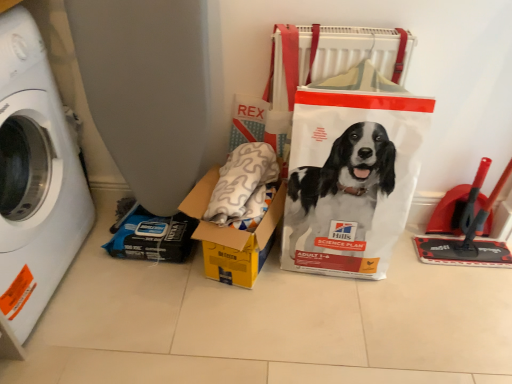
Identify the location of vacant space in front of white plastic bag at center. (341, 324).